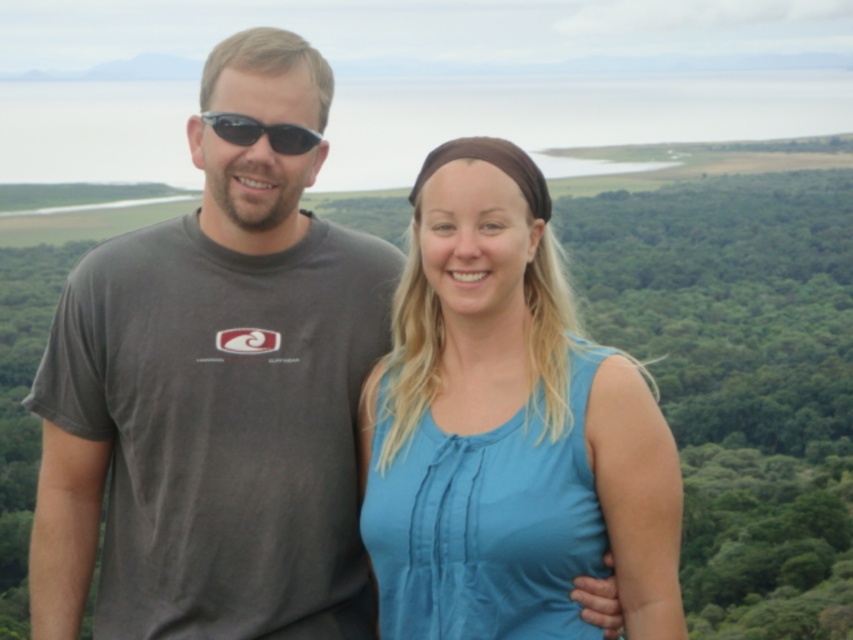
Question: Is blue cotton shirt at right positioned before black plastic sunglasses at left?

Choices:
 (A) no
 (B) yes

Answer: (B)

Question: Which point is closer to the camera?

Choices:
 (A) (491, 310)
 (B) (230, 136)

Answer: (B)

Question: Does blue cotton shirt at right appear on the left side of black plastic sunglasses at left?

Choices:
 (A) yes
 (B) no

Answer: (B)

Question: Does blue cotton shirt at right appear on the right side of black plastic sunglasses at left?

Choices:
 (A) no
 (B) yes

Answer: (B)

Question: Which point appears farthest from the camera in this image?

Choices:
 (A) (286, 154)
 (B) (447, 384)

Answer: (B)

Question: Which object appears farthest from the camera in this image?

Choices:
 (A) black plastic sunglasses at left
 (B) blue cotton shirt at right

Answer: (A)